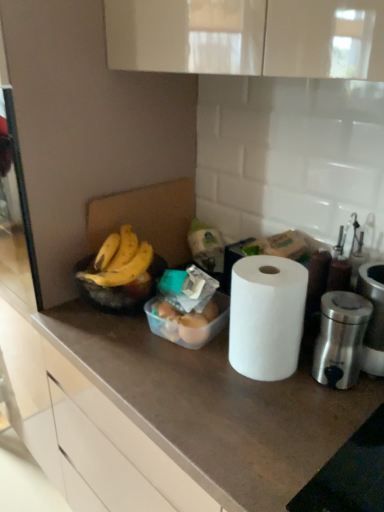
Find the location of a particular element. This screenshot has height=512, width=384. vacant area that is in front of polished stainless steel appliance at right is located at coordinates (333, 432).